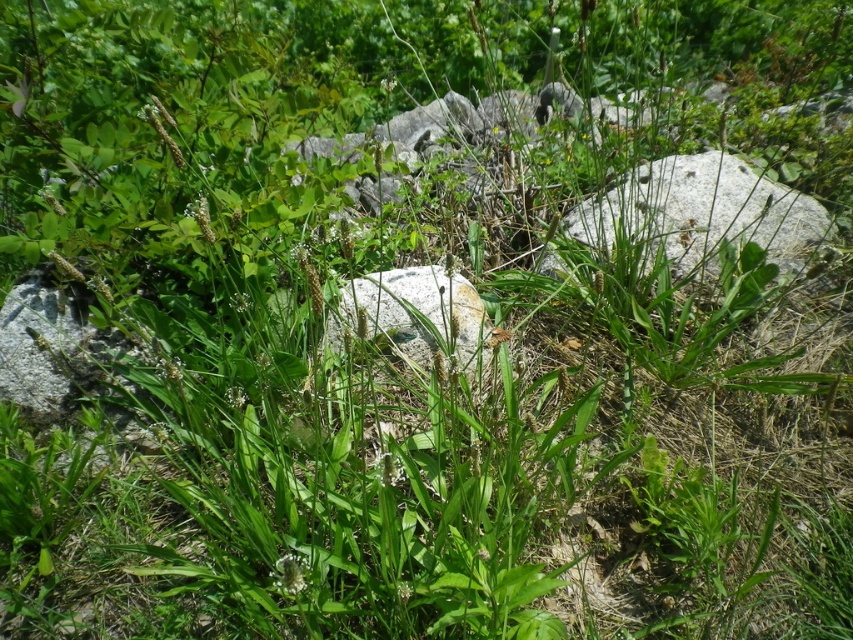
You are a hiker who wants to place a small backpack between the gray rough stone at center and the smooth gray rock at center. Which rock should you place the backpack closer to in order to have it closer to the foreground plants?

You should place the backpack closer to the gray rough stone at center because it is closer to the foreground plants than the smooth gray rock at center.

You are standing in the middle of the outdoor scene and notice two rocks in front of you. Which one is positioned to the right of the other? The gray rough stone at center and the smooth gray rock at center are both in your view. Could you tell me which one is on the right side?

The gray rough stone at center is positioned to the right of the smooth gray rock at center.